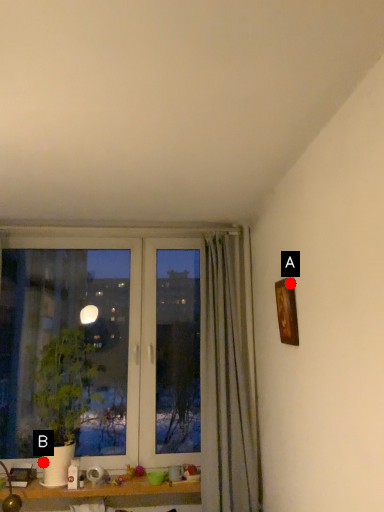
Question: Two points are circled on the image, labeled by A and B beside each circle. Which point appears farthest from the camera in this image?

Choices:
 (A) A is further
 (B) B is further

Answer: (B)